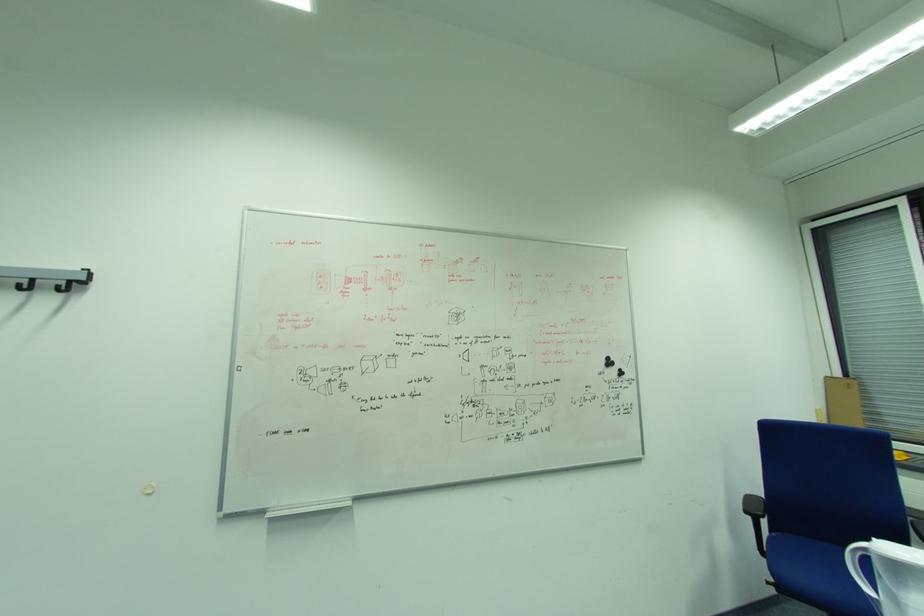
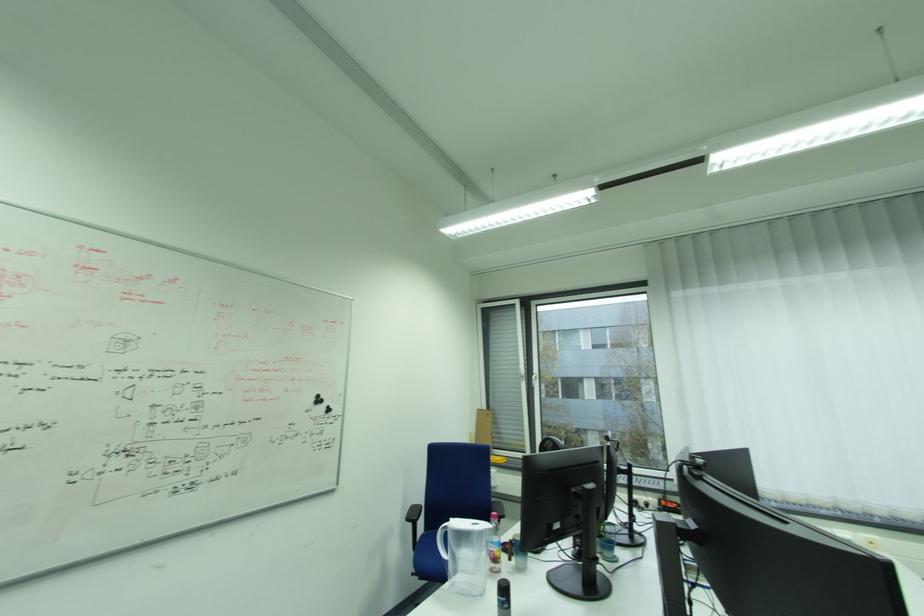
In the second image, find the point that corresponds to (x=755, y=513) in the first image.

(415, 521)